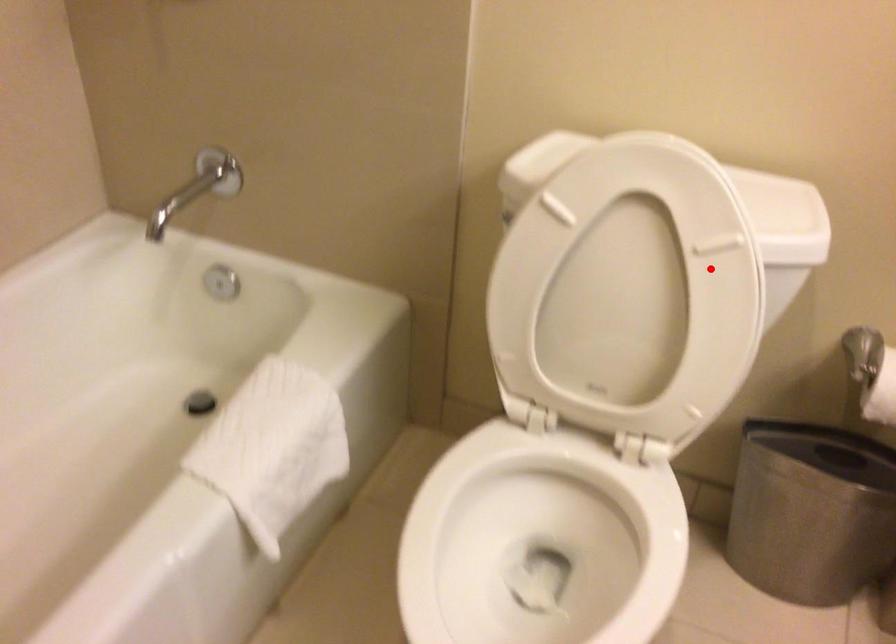
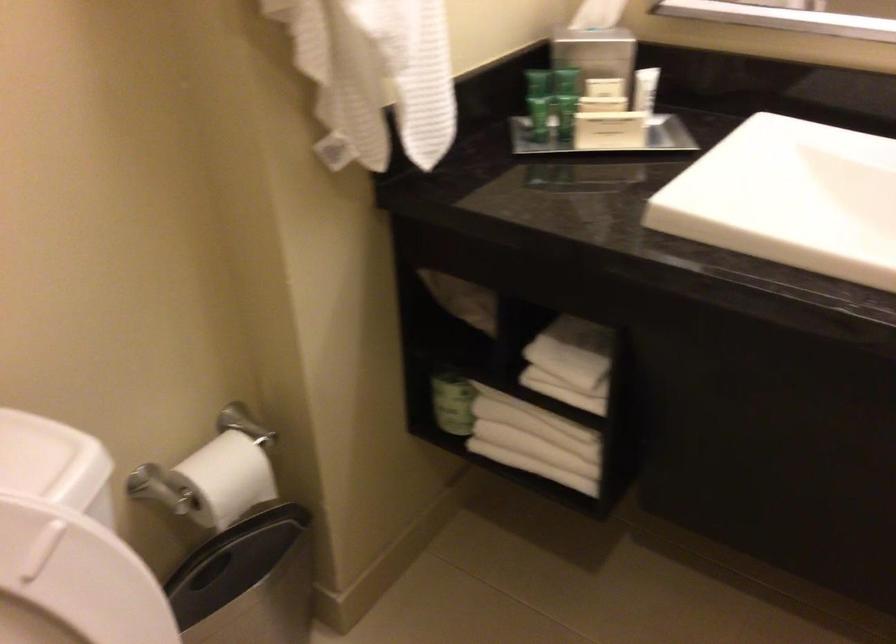
Question: I am providing you with two images of the same scene from different viewpoints. Given a red point in image1, look at the same physical point in image2. Is it:

Choices:
 (A) Closer to the viewpoint
 (B) Farther from the viewpoint

Answer: (A)